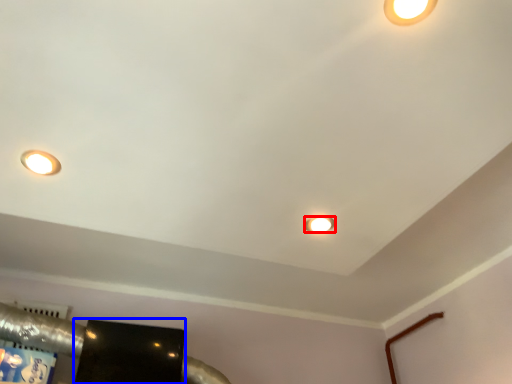
Question: Which object appears farthest to the camera in this image, lamp (highlighted by a red box) or wide (highlighted by a blue box)?

Choices:
 (A) lamp
 (B) wide

Answer: (B)